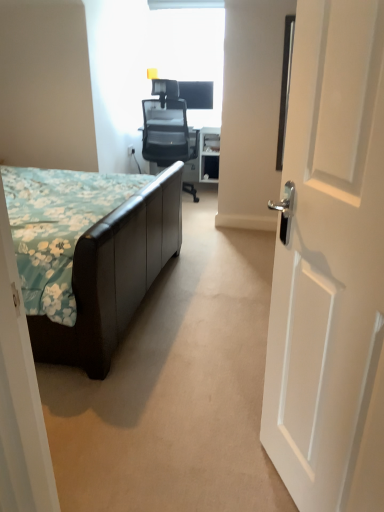
Question: Is white wooden door at right situated inside brown leather bed at left or outside?

Choices:
 (A) inside
 (B) outside

Answer: (B)

Question: From the image's perspective, is white wooden door at right above or below brown leather bed at left?

Choices:
 (A) below
 (B) above

Answer: (A)

Question: Considering the real-world distances, which object is closest to the black mesh office chair at center?

Choices:
 (A) white wooden door at right
 (B) brown leather bed at left

Answer: (B)

Question: Which object is positioned closest to the brown leather bed at left?

Choices:
 (A) white wooden door at right
 (B) black mesh office chair at center

Answer: (A)